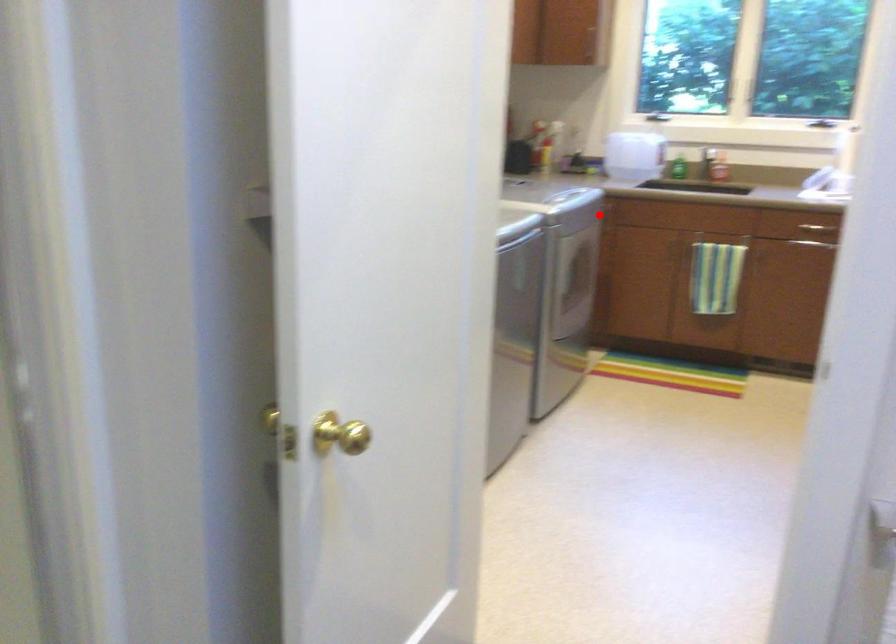
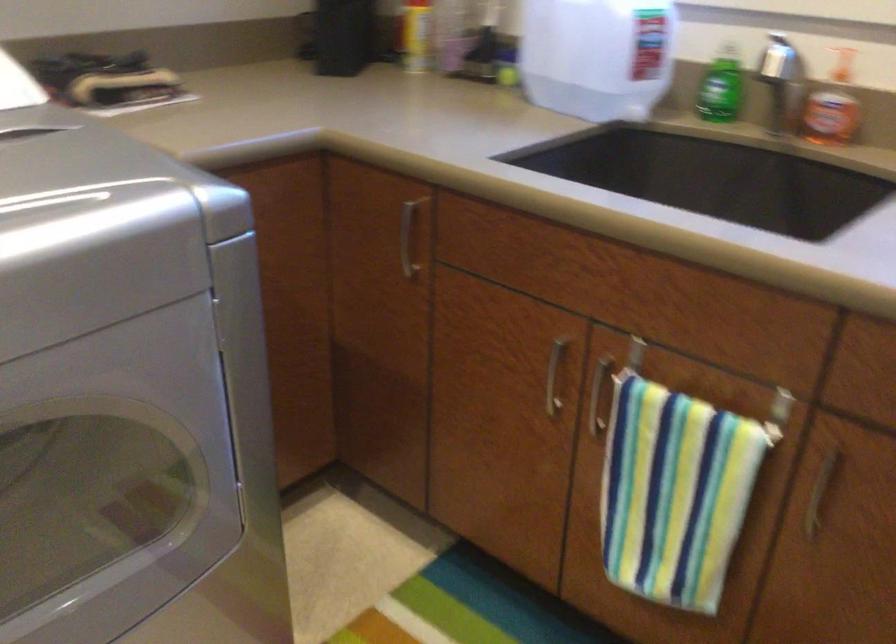
Find the pixel in the second image that matches the highlighted location in the first image.

(407, 238)